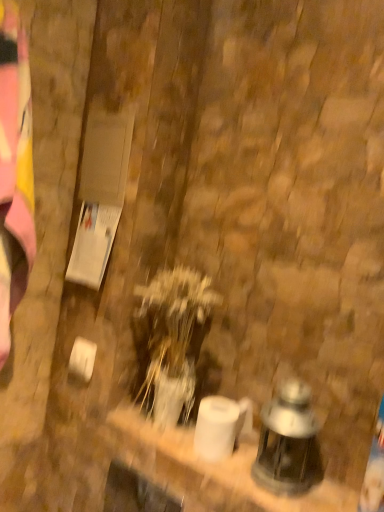
Locate an element on the screen. The image size is (384, 512). free point below translucent glass vase at center (from a real-world perspective) is located at coordinates (168, 430).